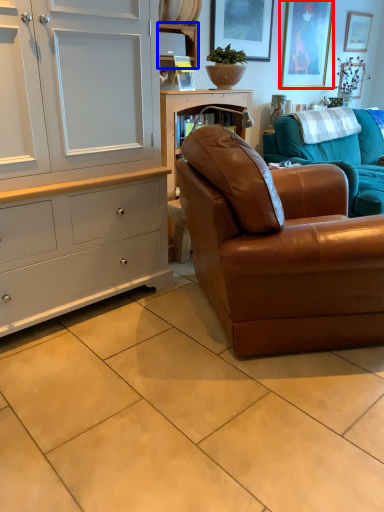
Question: Which object is closer to the camera taking this photo, picture frame (highlighted by a red box) or shelf (highlighted by a blue box)?

Choices:
 (A) picture frame
 (B) shelf

Answer: (B)